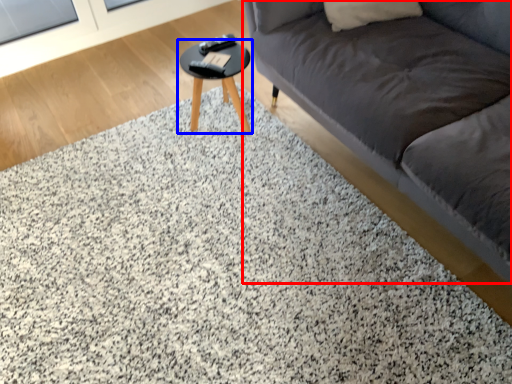
Question: Which point is further to the camera, studio couch (highlighted by a red box) or table (highlighted by a blue box)?

Choices:
 (A) studio couch
 (B) table

Answer: (B)